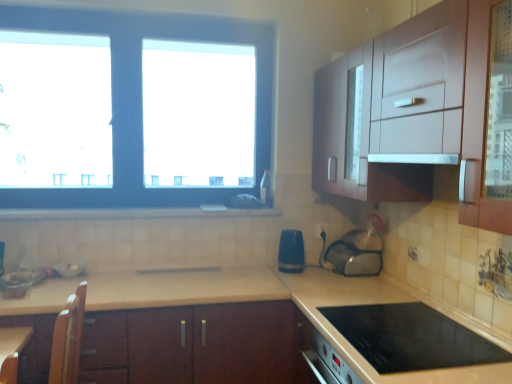
This screenshot has width=512, height=384. Describe the element at coordinates (291, 251) in the screenshot. I see `blue plastic toaster at center, marked as the second appliance in a left-to-right arrangement` at that location.

This screenshot has height=384, width=512. What do you see at coordinates (132, 213) in the screenshot?
I see `white tile at lower center` at bounding box center [132, 213].

The height and width of the screenshot is (384, 512). Describe the element at coordinates (140, 100) in the screenshot. I see `blue matte window at upper left` at that location.

The width and height of the screenshot is (512, 384). What do you see at coordinates (415, 158) in the screenshot?
I see `white glossy exhaust hood at upper right` at bounding box center [415, 158].

Identify the location of blue plastic toaster at center, which is the 2th appliance from right to left. This screenshot has width=512, height=384. (291, 251).

Is white glossy exhaust hood at upper right facing away from blue matte window at upper left?

No, white glossy exhaust hood at upper right's orientation is not away from blue matte window at upper left.

Is white glossy exhaust hood at upper right not close to blue matte window at upper left?

Indeed, white glossy exhaust hood at upper right is not near blue matte window at upper left.

Considering the points (420, 157) and (29, 193), which point is in front, point (420, 157) or point (29, 193)?

Positioned in front is point (420, 157).

Where is `exhaust hood that is on the right side of blue matte window at upper left`? The height and width of the screenshot is (384, 512). exhaust hood that is on the right side of blue matte window at upper left is located at coordinates (x=415, y=158).

Looking at this image, how distant is blue plastic toaster at center, marked as the second appliance in a left-to-right arrangement, from white glossy exhaust hood at upper right?

38.50 inches.

Considering the relative sizes of blue plastic toaster at center, marked as the second appliance in a left-to-right arrangement, and white glossy exhaust hood at upper right in the image provided, is blue plastic toaster at center, marked as the second appliance in a left-to-right arrangement, smaller than white glossy exhaust hood at upper right?

Correct, blue plastic toaster at center, marked as the second appliance in a left-to-right arrangement, occupies less space than white glossy exhaust hood at upper right.

Considering the positions of objects blue plastic toaster at center, marked as the second appliance in a left-to-right arrangement, and blue matte window at upper left in the image provided, who is more to the left, blue plastic toaster at center, marked as the second appliance in a left-to-right arrangement, or blue matte window at upper left?

From the viewer's perspective, blue matte window at upper left appears more on the left side.

Based on their sizes in the image, would you say blue plastic toaster at center, marked as the second appliance in a left-to-right arrangement, is bigger or smaller than blue matte window at upper left?

blue plastic toaster at center, marked as the second appliance in a left-to-right arrangement, is smaller than blue matte window at upper left.

Could you measure the distance between blue plastic toaster at center, marked as the second appliance in a left-to-right arrangement, and blue matte window at upper left?

A distance of 37.71 inches exists between blue plastic toaster at center, marked as the second appliance in a left-to-right arrangement, and blue matte window at upper left.

Can you see blue plastic toaster at center, marked as the second appliance in a left-to-right arrangement, touching blue matte window at upper left?

blue plastic toaster at center, marked as the second appliance in a left-to-right arrangement, is not next to blue matte window at upper left, and they're not touching.

Is black plastic electric outlet at center placed right next to blue plastic toaster at center, marked as the second appliance in a left-to-right arrangement?

black plastic electric outlet at center and blue plastic toaster at center, marked as the second appliance in a left-to-right arrangement, are not in contact.

Can you tell me how much black plastic electric outlet at center and blue plastic toaster at center, which is the 2th appliance from right to left, differ in facing direction?

They differ by 0.0037 degrees in their facing directions.

Which object is closer to the camera, black plastic electric outlet at center or blue plastic toaster at center, which is the 2th appliance from right to left?

blue plastic toaster at center, which is the 2th appliance from right to left, is in front.

Does black plastic electric outlet at center have a greater width compared to brown wood cabinet at center?

No.

Are black plastic electric outlet at center and brown wood cabinet at center far apart?

Absolutely, black plastic electric outlet at center is distant from brown wood cabinet at center.

Does black plastic electric outlet at center have a smaller size compared to brown wood cabinet at center?

Indeed, black plastic electric outlet at center has a smaller size compared to brown wood cabinet at center.

How many degrees apart are the facing directions of black plastic electric outlet at center and brown wood cabinet at center?

The angular difference between black plastic electric outlet at center and brown wood cabinet at center is 3.17 degrees.

Which is behind, point (318, 229) or point (434, 154)?

The point (318, 229) is more distant.

Considering the relative positions of black plastic electric outlet at center and white glossy exhaust hood at upper right in the image provided, is black plastic electric outlet at center to the left of white glossy exhaust hood at upper right from the viewer's perspective?

Correct, you'll find black plastic electric outlet at center to the left of white glossy exhaust hood at upper right.

Is black plastic electric outlet at center wider than white glossy exhaust hood at upper right?

No, black plastic electric outlet at center is not wider than white glossy exhaust hood at upper right.

From the image's perspective, which is below, black plastic electric outlet at center or white glossy exhaust hood at upper right?

black plastic electric outlet at center is shown below in the image.

The height and width of the screenshot is (384, 512). Identify the location of window sill on the right of the blue matte window at upper left. (132, 213).

Which of these two, blue matte window at upper left or white tile at lower center, is bigger?

With larger size is blue matte window at upper left.

From a real-world perspective, is blue matte window at upper left positioned above or below white tile at lower center?

Clearly, from a real-world perspective, blue matte window at upper left is above white tile at lower center.

In terms of width, does blue matte window at upper left look wider or thinner when compared to white tile at lower center?

Considering their sizes, blue matte window at upper left looks slimmer than white tile at lower center.

Locate an element on the screen. The image size is (512, 384). window behind the white glossy exhaust hood at upper right is located at coordinates (140, 100).

Where is `appliance that is the 2nd object to the left of the white glossy exhaust hood at upper right, starting at the anchor`? This screenshot has height=384, width=512. appliance that is the 2nd object to the left of the white glossy exhaust hood at upper right, starting at the anchor is located at coordinates (291, 251).

When comparing their distances from transparent plastic bag at center, the third appliance from the left, does blue matte window at upper left or white tile at lower center seem closer?

Based on the image, white tile at lower center appears to be nearer to transparent plastic bag at center, the third appliance from the left.

Considering their positions, is black glass cooktop at lower right positioned further to white glossy exhaust hood at upper right than brown wood cabinet at center?

brown wood cabinet at center lies further to white glossy exhaust hood at upper right than the other object.

From the image, which object appears to be farther from black plastic electric outlet at center, blue matte window at upper left or metallic silver bowl at lower left, which is the third appliance from right to left?

metallic silver bowl at lower left, which is the third appliance from right to left.

When comparing their distances from white tile at lower center, does black glass cooktop at lower right or black plastic electric outlet at center seem further?

black glass cooktop at lower right is positioned further to the anchor white tile at lower center.

When comparing their distances from transparent plastic bag at center, marked as the 1th appliance in a right-to-left arrangement, does blue plastic toaster at center, which is the 2th appliance from right to left, or black glass cooktop at lower right seem further?

black glass cooktop at lower right.

Estimate the real-world distances between objects in this image. Which object is closer to white tile at lower center, blue matte window at upper left or black glass cooktop at lower right?

The object closer to white tile at lower center is blue matte window at upper left.

From the image, which object appears to be nearer to metallic silver bowl at lower left, which ranks as the 1th appliance in left-to-right order, brown wood cabinet at center or black glass cooktop at lower right?

brown wood cabinet at center.

From the image, which object appears to be nearer to white glossy exhaust hood at upper right, white tile at lower center or blue plastic toaster at center, which is the 2th appliance from right to left?

blue plastic toaster at center, which is the 2th appliance from right to left.

Where is `cabinetry between white tile at lower center and black plastic electric outlet at center from left to right`? This screenshot has height=384, width=512. cabinetry between white tile at lower center and black plastic electric outlet at center from left to right is located at coordinates (194, 345).

Image resolution: width=512 pixels, height=384 pixels. I want to click on electric outlet between white tile at lower center and transparent plastic bag at center, marked as the 1th appliance in a right-to-left arrangement, so pos(321,229).

The height and width of the screenshot is (384, 512). Identify the location of window sill between metallic silver bowl at lower left, which is the third appliance from right to left, and transparent plastic bag at center, the third appliance from the left, in the horizontal direction. (132, 213).

Find the location of a particular element. window sill situated between metallic silver bowl at lower left, which is the third appliance from right to left, and black glass cooktop at lower right from left to right is located at coordinates (132, 213).